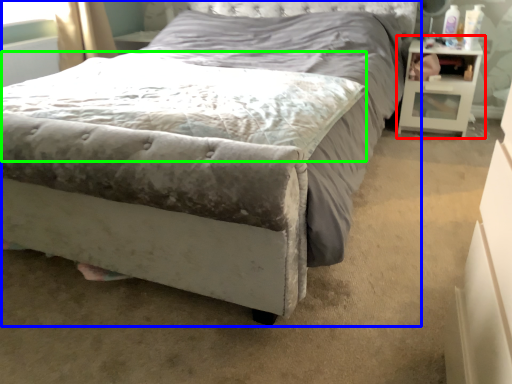
Question: Which is farther away from nightstand (highlighted by a red box)? bed (highlighted by a blue box) or mattress (highlighted by a green box)?

Choices:
 (A) bed
 (B) mattress

Answer: (B)